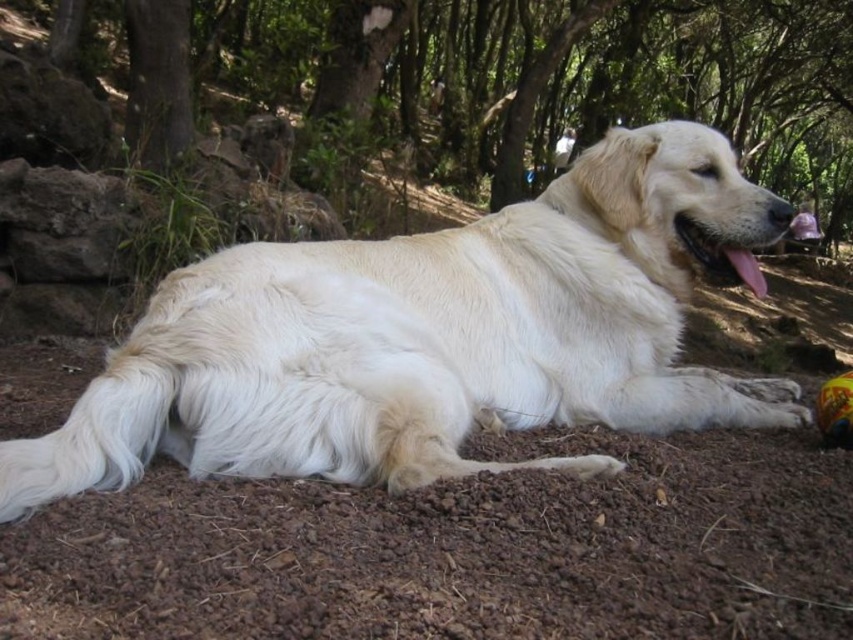
Between white fluffy dog at center and green leafy tree at upper center, which one has more height?

green leafy tree at upper center is taller.

I want to click on white fluffy dog at center, so click(433, 337).

Between point (756, 285) and point (788, 90), which one is positioned in front?

Positioned in front is point (756, 285).

Find the location of a particular element. This screenshot has width=853, height=640. white fluffy dog at center is located at coordinates (433, 337).